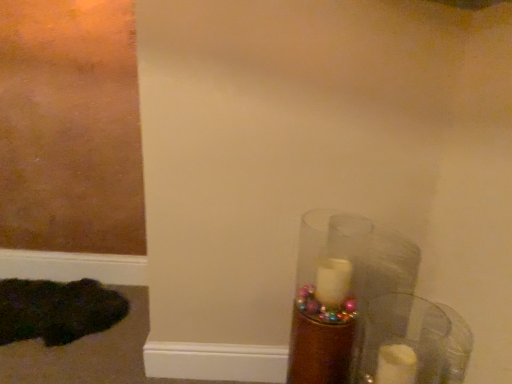
Question: In the image, is dark green fur at lower left on the left side or the right side of translucent glass candle at lower right?

Choices:
 (A) left
 (B) right

Answer: (A)

Question: Is dark green fur at lower left in front of or behind translucent glass candle at lower right in the image?

Choices:
 (A) front
 (B) behind

Answer: (B)

Question: Estimate the real-world distances between objects in this image. Which object is closer to the translucent glass candle at lower right?

Choices:
 (A) dark green fur at lower left
 (B) transparent glass candle at right

Answer: (B)

Question: Which of these objects is positioned farthest from the translucent glass candle at lower right?

Choices:
 (A) dark green fur at lower left
 (B) transparent glass candle at right

Answer: (A)